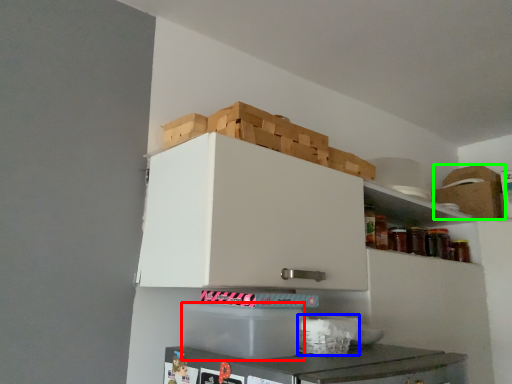
Question: Estimate the real-world distances between objects in this image. Which object is farther from cardboard box (highlighted by a red box), basket (highlighted by a blue box) or cardboard box (highlighted by a green box)?

Choices:
 (A) basket
 (B) cardboard box

Answer: (B)